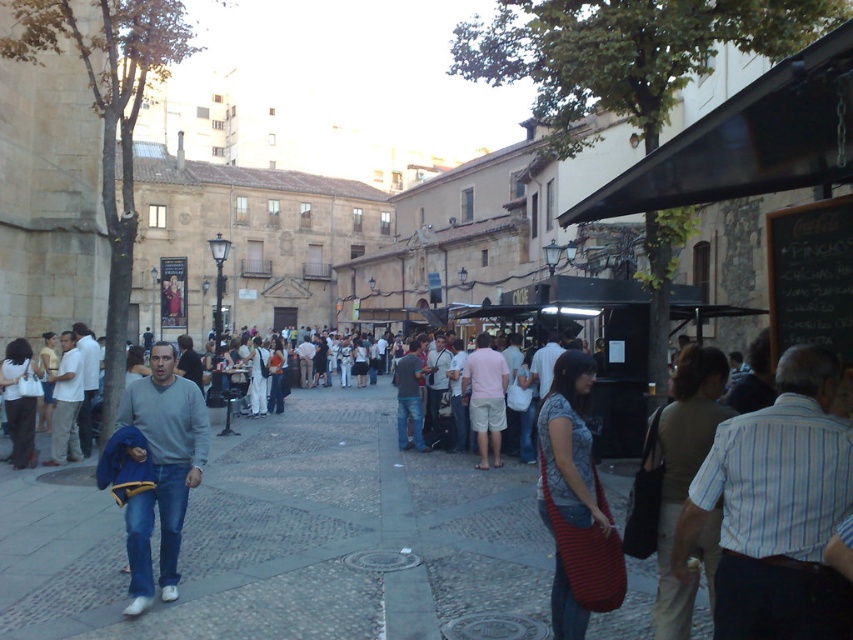
You are standing at the center of the square and want to approach the blue striped shirt at center. Which direction should you move to reach it?

Since the blue striped shirt at center is located at point (776, 509), you should move towards the center of the square to reach it.

You are a photographer standing in the town square and want to capture both the blue striped shirt at center and the striped fabric bag at lower right in a single shot. Which object should you position closer to the left side of the frame to ensure both are included?

You should position the striped fabric bag at lower right closer to the left side of the frame because the blue striped shirt at center is already to the right of it.

You are standing at the point labeled point [19,400] and want to walk towards the point labeled point [328,433]. Which direction should you move to get closer to your destination?

You should move towards the point labeled point [328,433] because it is closer to you than the other point.